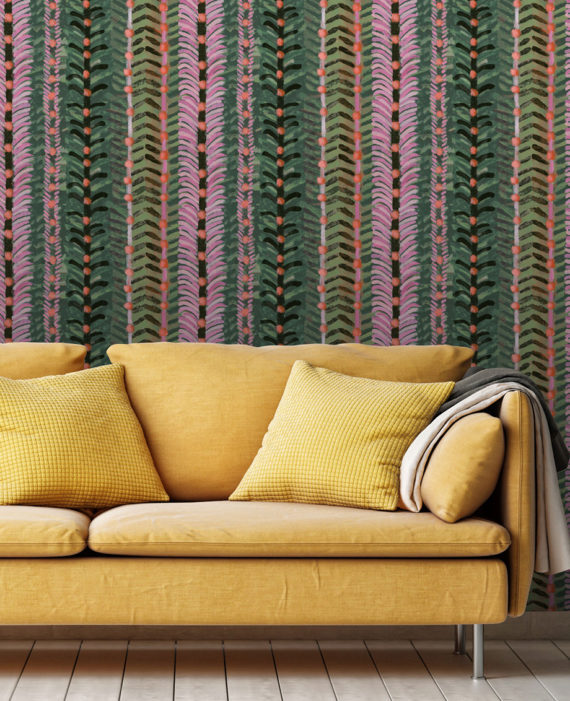
Where is `seat cushions`? seat cushions is located at coordinates (223, 519), (35, 533).